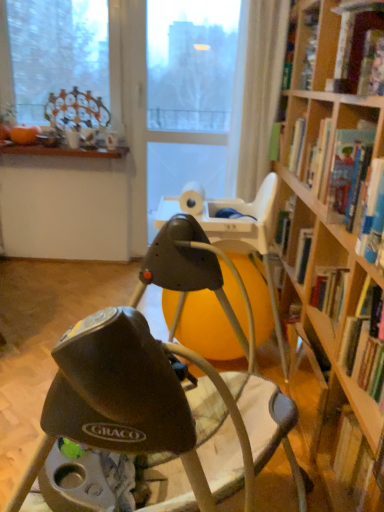
Question: Is matte black baby swing at center turned away from transparent plastic screen door at center?

Choices:
 (A) no
 (B) yes

Answer: (A)

Question: Considering the relative sizes of matte black baby swing at center and transparent plastic screen door at center in the image provided, is matte black baby swing at center thinner than transparent plastic screen door at center?

Choices:
 (A) no
 (B) yes

Answer: (A)

Question: Considering the relative positions of matte black baby swing at center and transparent plastic screen door at center in the image provided, is matte black baby swing at center behind transparent plastic screen door at center?

Choices:
 (A) no
 (B) yes

Answer: (A)

Question: Considering the relative positions of matte black baby swing at center and transparent plastic screen door at center in the image provided, is matte black baby swing at center to the right of transparent plastic screen door at center from the viewer's perspective?

Choices:
 (A) no
 (B) yes

Answer: (A)

Question: Is matte black baby swing at center directly adjacent to transparent plastic screen door at center?

Choices:
 (A) no
 (B) yes

Answer: (A)

Question: Based on their positions, is hardcover book at upper right, arranged as the second book when ordered from the bottom, located to the left or right of matte black baby swing at center?

Choices:
 (A) left
 (B) right

Answer: (B)

Question: Considering their positions, is hardcover book at upper right, the 2th book from the top, located in front of or behind matte black baby swing at center?

Choices:
 (A) front
 (B) behind

Answer: (B)

Question: In terms of height, does hardcover book at upper right, the 2th book from the top, look taller or shorter compared to matte black baby swing at center?

Choices:
 (A) tall
 (B) short

Answer: (B)

Question: Is point tap(344, 196) closer or farther from the camera than point tap(152, 244)?

Choices:
 (A) farther
 (B) closer

Answer: (A)

Question: In terms of size, does matte black baby swing at center appear bigger or smaller than hardcover book at upper right, the 1th book in the top-to-bottom sequence?

Choices:
 (A) small
 (B) big

Answer: (B)

Question: From a real-world perspective, is matte black baby swing at center physically located above or below hardcover book at upper right, which is counted as the 3th book, starting from the bottom?

Choices:
 (A) below
 (B) above

Answer: (A)

Question: Is matte black baby swing at center in front of or behind hardcover book at upper right, which is counted as the 3th book, starting from the bottom, in the image?

Choices:
 (A) behind
 (B) front

Answer: (B)

Question: From their relative heights in the image, would you say matte black baby swing at center is taller or shorter than hardcover book at upper right, which is counted as the 3th book, starting from the bottom?

Choices:
 (A) tall
 (B) short

Answer: (A)

Question: In the image, is hardcover book at upper right, the 2th book from the top, positioned in front of or behind hardcover book at right, which is the 3th book in top-to-bottom order?

Choices:
 (A) behind
 (B) front

Answer: (A)

Question: In terms of width, does hardcover book at upper right, the 2th book from the top, look wider or thinner when compared to hardcover book at right, which is the first book from bottom to top?

Choices:
 (A) thin
 (B) wide

Answer: (B)